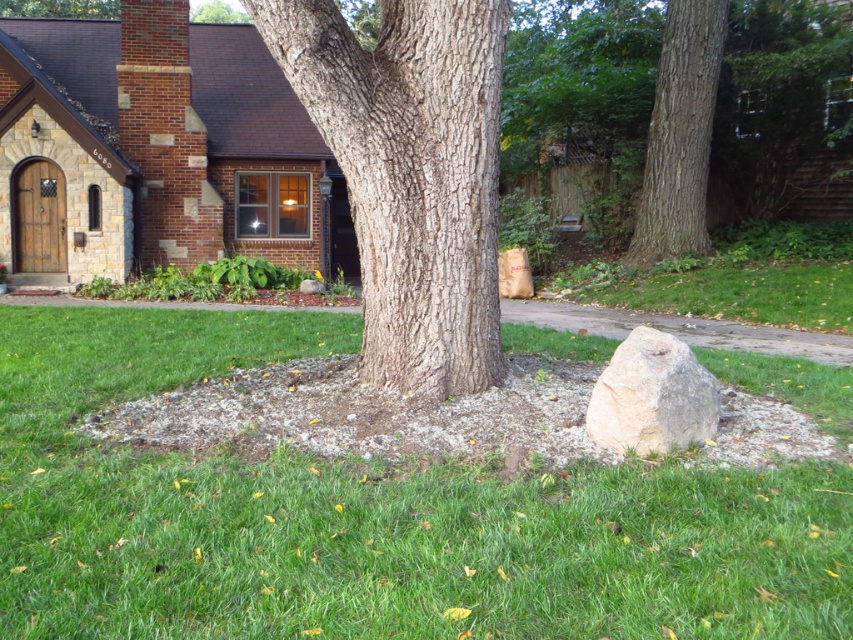
Question: Can you confirm if green grass at center is positioned to the left of smooth bark tree at center?

Choices:
 (A) no
 (B) yes

Answer: (B)

Question: Which of the following is the closest to the observer?

Choices:
 (A) (701, 140)
 (B) (403, 486)
 (C) (306, 0)

Answer: (B)

Question: Is green grass at center closer to camera compared to smooth bark tree at center?

Choices:
 (A) no
 (B) yes

Answer: (B)

Question: Which object is closer to the camera taking this photo?

Choices:
 (A) rough bark tree trunk at upper center
 (B) smooth beige rock at center

Answer: (B)

Question: Estimate the real-world distances between objects in this image. Which object is farther from the smooth beige rock at center?

Choices:
 (A) rough bark tree trunk at upper center
 (B) green grass at center
 (C) smooth bark tree at center

Answer: (A)

Question: Does green grass at center appear over smooth beige rock at center?

Choices:
 (A) yes
 (B) no

Answer: (B)